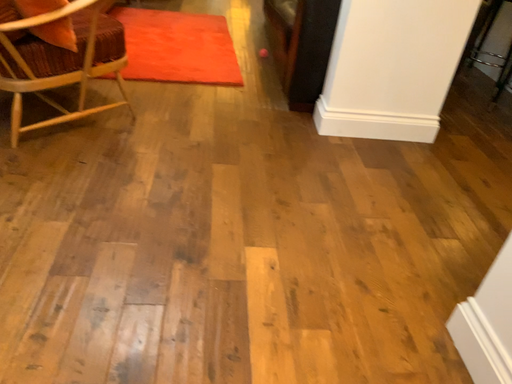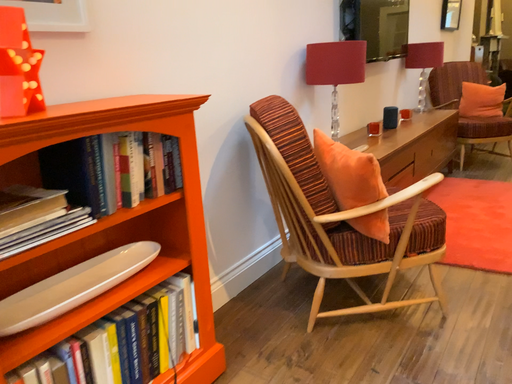
Question: How did the camera likely rotate when shooting the video?

Choices:
 (A) rotated right
 (B) rotated left

Answer: (B)